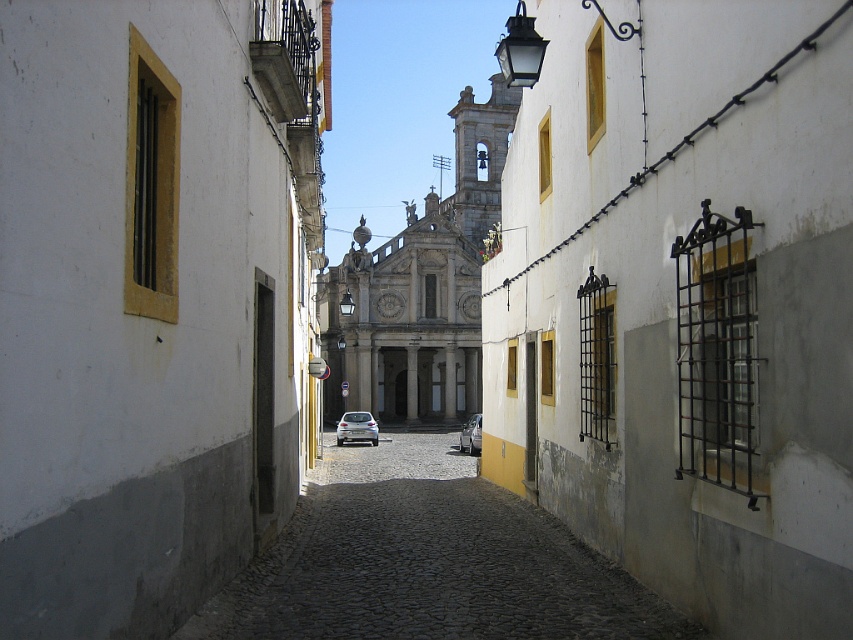
Question: Which of the following is the farthest from the observer?

Choices:
 (A) white plaster wall at center
 (B) white plaster wall at left

Answer: (A)

Question: Is the position of white plaster wall at left more distant than that of smooth cobblestone alley at center?

Choices:
 (A) yes
 (B) no

Answer: (B)

Question: Can you confirm if white plaster wall at left is positioned below smooth cobblestone alley at center?

Choices:
 (A) no
 (B) yes

Answer: (A)

Question: Which object is farther from the camera taking this photo?

Choices:
 (A) silver metallic car at center
 (B) white stone church at center

Answer: (B)

Question: Does white plaster wall at center appear on the right side of white plaster wall at left?

Choices:
 (A) yes
 (B) no

Answer: (A)

Question: Which of the following is the closest to the observer?

Choices:
 (A) (335, 280)
 (B) (12, 124)
 (C) (339, 426)

Answer: (B)